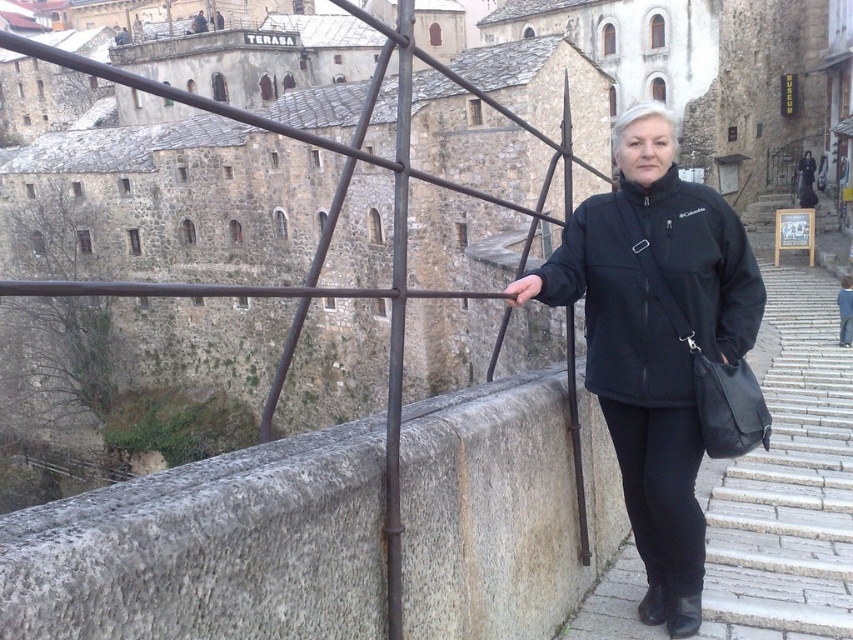
Based on the photo, is black softshell jacket at center taller than gray stone stairs at lower right?

Indeed, black softshell jacket at center has a greater height compared to gray stone stairs at lower right.

Which is behind, point (714, 316) or point (822, 401)?

Point (822, 401)

Where is `black softshell jacket at center`? The width and height of the screenshot is (853, 640). black softshell jacket at center is located at coordinates (654, 339).